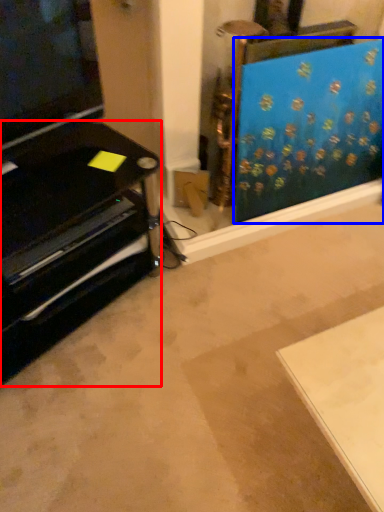
Question: Which object is further to the camera taking this photo, furniture (highlighted by a red box) or curtain (highlighted by a blue box)?

Choices:
 (A) furniture
 (B) curtain

Answer: (B)